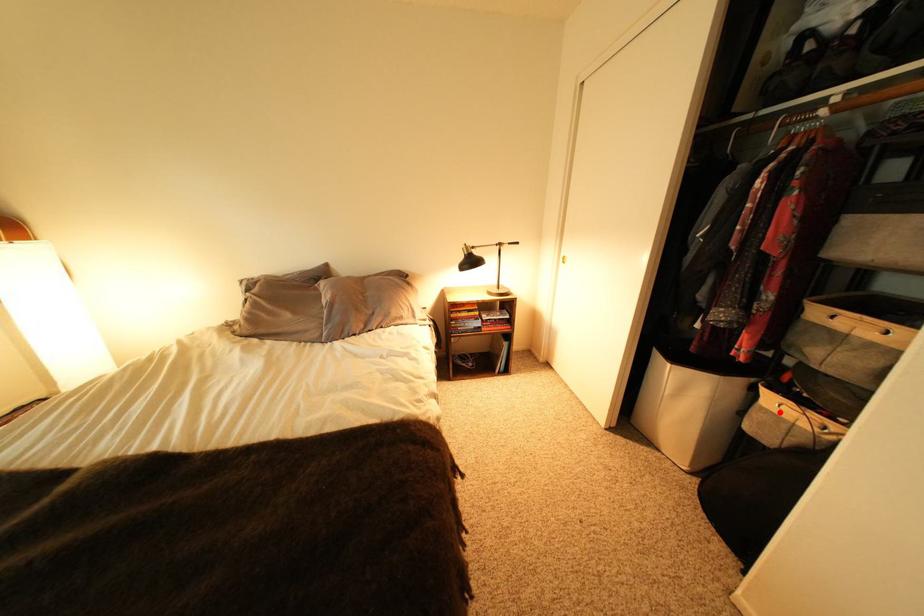
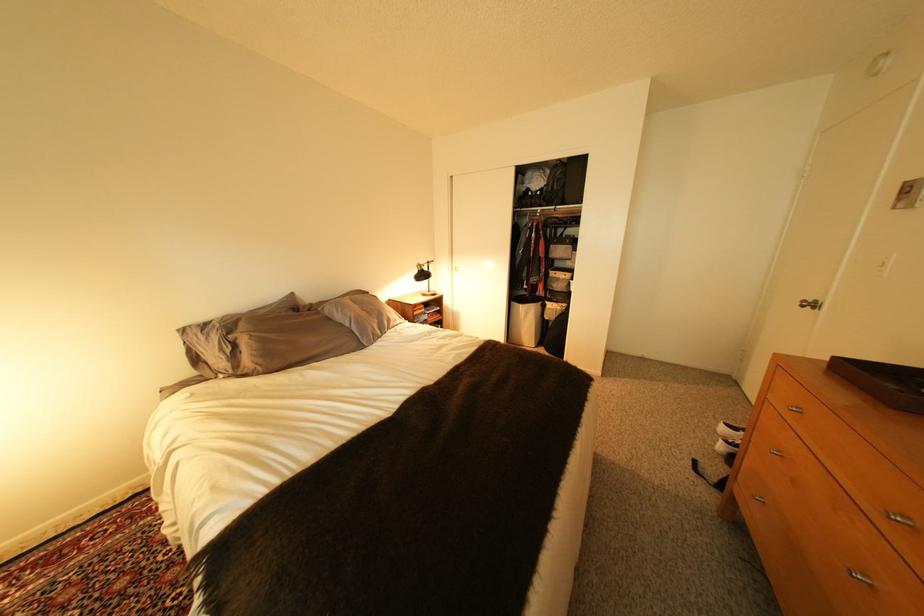
Find the pixel in the second image that matches the highlighted location in the first image.

(563, 310)